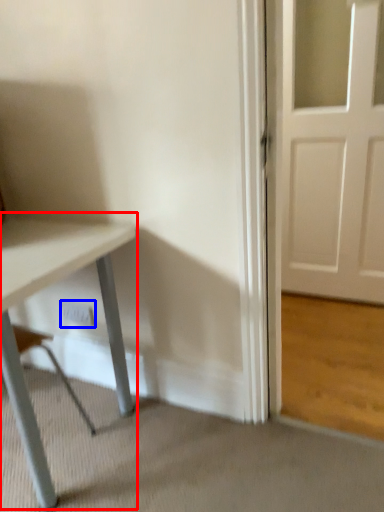
Question: Which of the following is the farthest to the observer, table (highlighted by a red box) or electric outlet (highlighted by a blue box)?

Choices:
 (A) table
 (B) electric outlet

Answer: (B)